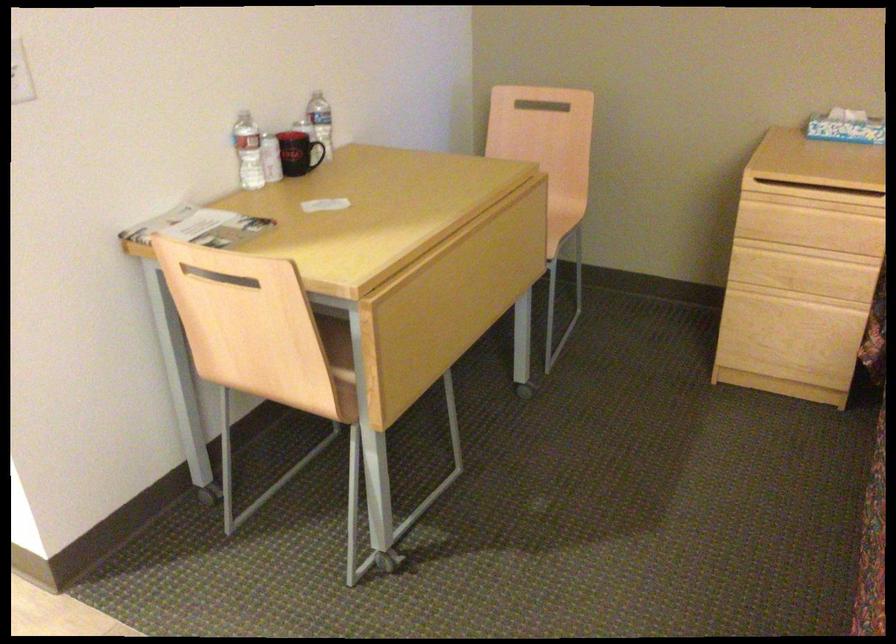
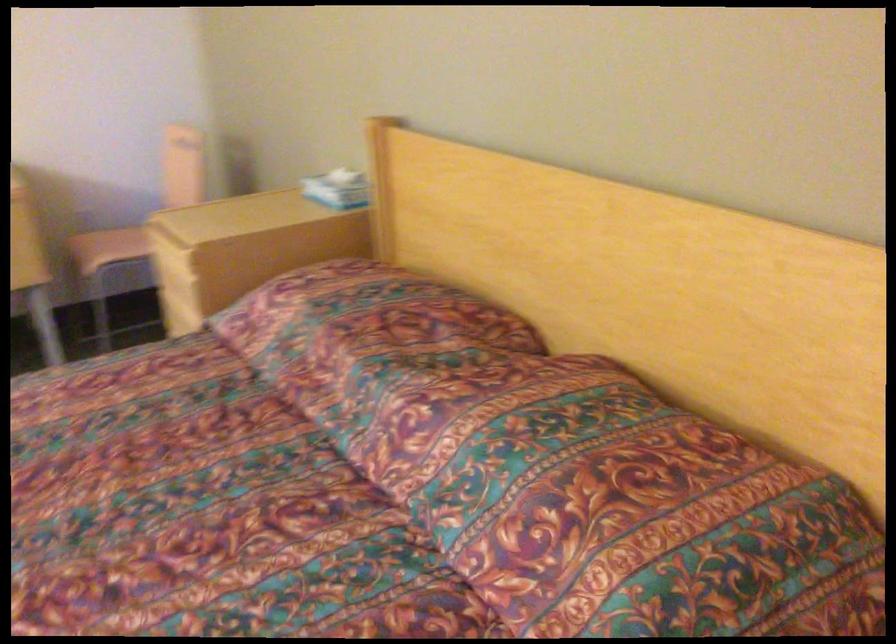
Question: I am providing you with two images of the same scene from different viewpoints. After the viewpoint changes to image2, which objects are now occluded?

Choices:
 (A) drawer handle
 (B) patterned pillow
 (C) chair sitting surface
 (D) black patterned pillow

Answer: (A)